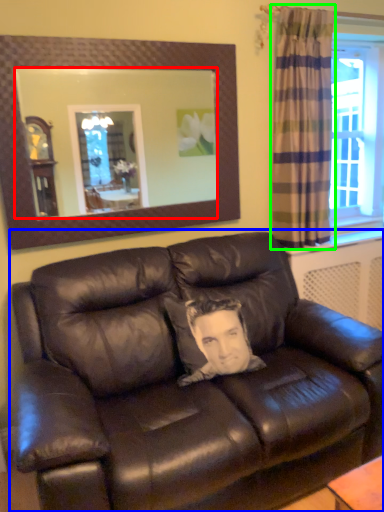
Question: Which is nearer to the mirror (highlighted by a red box)? studio couch (highlighted by a blue box) or curtain (highlighted by a green box).

Choices:
 (A) studio couch
 (B) curtain

Answer: (B)